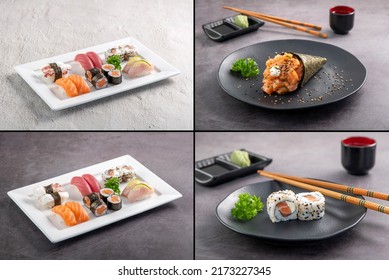
Find the location of `soy sauce holder`. soy sauce holder is located at coordinates (216, 167).